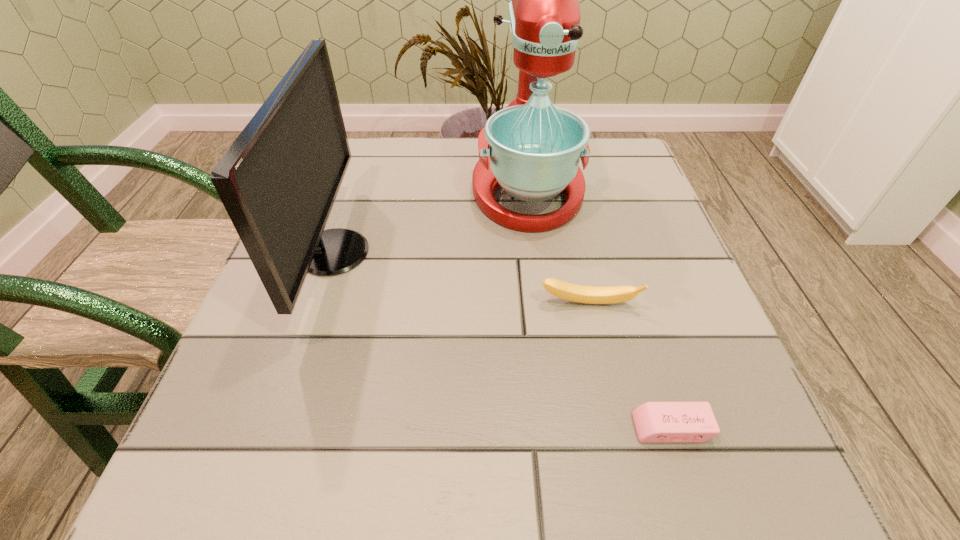
In order to click on mixer in this screenshot , I will do `click(531, 149)`.

Locate an element on the screen. The image size is (960, 540). computer monitor is located at coordinates (278, 181).

The width and height of the screenshot is (960, 540). Find the location of `the third shortest object`. the third shortest object is located at coordinates (278, 181).

Where is `banana`? This screenshot has height=540, width=960. banana is located at coordinates coord(571,292).

Where is `the shortest object`? the shortest object is located at coordinates (655, 422).

Find the location of a particular element. The height and width of the screenshot is (540, 960). the nearest object is located at coordinates (655, 422).

This screenshot has height=540, width=960. I want to click on vacant space located 0.140m on the front-facing side of the tallest object, so click(540, 288).

The image size is (960, 540). I want to click on vacant space located 0.140m on the front-facing side of the third shortest object, so click(443, 252).

Locate an element on the screen. blank space located at the stem of the third tallest object is located at coordinates (614, 420).

Where is `free region located 0.130m on the left of the nearest object`? free region located 0.130m on the left of the nearest object is located at coordinates click(538, 428).